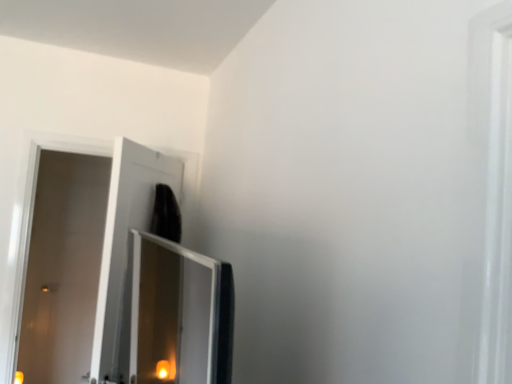
Question: Should I look upward or downward to see white glossy door at left?

Choices:
 (A) down
 (B) up

Answer: (A)

Question: From the image's perspective, is white glossy door at left over transparent glass screen door at upper left?

Choices:
 (A) no
 (B) yes

Answer: (B)

Question: Considering the relative sizes of white glossy door at left and transparent glass screen door at upper left in the image provided, is white glossy door at left thinner than transparent glass screen door at upper left?

Choices:
 (A) yes
 (B) no

Answer: (A)

Question: Does white glossy door at left appear on the left side of transparent glass screen door at upper left?

Choices:
 (A) no
 (B) yes

Answer: (B)

Question: Can you confirm if white glossy door at left is shorter than transparent glass screen door at upper left?

Choices:
 (A) yes
 (B) no

Answer: (B)

Question: From the image's perspective, would you say white glossy door at left is shown under transparent glass screen door at upper left?

Choices:
 (A) no
 (B) yes

Answer: (A)

Question: From a real-world perspective, is white glossy door at left positioned over transparent glass screen door at upper left based on gravity?

Choices:
 (A) no
 (B) yes

Answer: (A)

Question: Can you confirm if transparent glass screen door at upper left is positioned to the right of white glossy door at left?

Choices:
 (A) yes
 (B) no

Answer: (A)

Question: Considering the relative sizes of transparent glass screen door at upper left and white glossy door at left in the image provided, is transparent glass screen door at upper left thinner than white glossy door at left?

Choices:
 (A) no
 (B) yes

Answer: (A)

Question: From the image's perspective, is transparent glass screen door at upper left located beneath white glossy door at left?

Choices:
 (A) no
 (B) yes

Answer: (B)

Question: Can you confirm if transparent glass screen door at upper left is positioned to the left of white glossy door at left?

Choices:
 (A) yes
 (B) no

Answer: (B)

Question: Considering the relative sizes of transparent glass screen door at upper left and white glossy door at left in the image provided, is transparent glass screen door at upper left wider than white glossy door at left?

Choices:
 (A) no
 (B) yes

Answer: (B)

Question: Does transparent glass screen door at upper left have a larger size compared to white glossy door at left?

Choices:
 (A) no
 (B) yes

Answer: (B)

Question: Do you think white glossy door at left is within transparent glass screen door at upper left, or outside of it?

Choices:
 (A) inside
 (B) outside

Answer: (B)